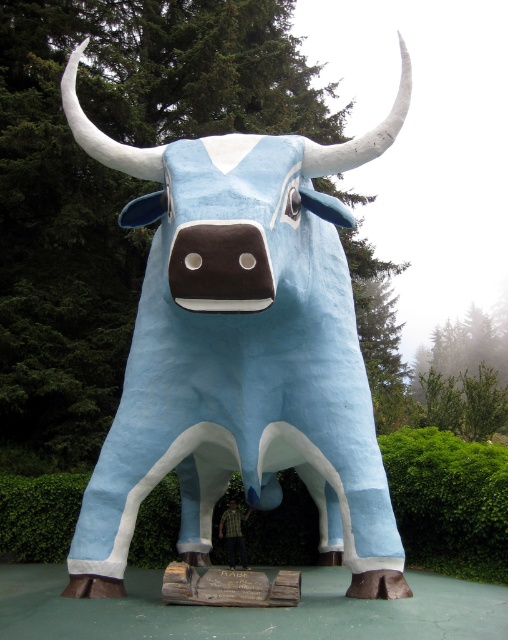
Question: Which of the following is the farthest from the observer?

Choices:
 (A) green leafy hedge at lower center
 (B) light blue matte bull at center

Answer: (A)

Question: Does light blue matte bull at center have a lesser width compared to green leafy hedge at lower center?

Choices:
 (A) no
 (B) yes

Answer: (A)

Question: Which point appears closest to the camera in this image?

Choices:
 (A) [x=458, y=518]
 (B) [x=347, y=269]

Answer: (B)

Question: Does light blue matte bull at center appear on the right side of green leafy hedge at lower center?

Choices:
 (A) yes
 (B) no

Answer: (B)

Question: Can you confirm if light blue matte bull at center is wider than green leafy hedge at lower center?

Choices:
 (A) yes
 (B) no

Answer: (A)